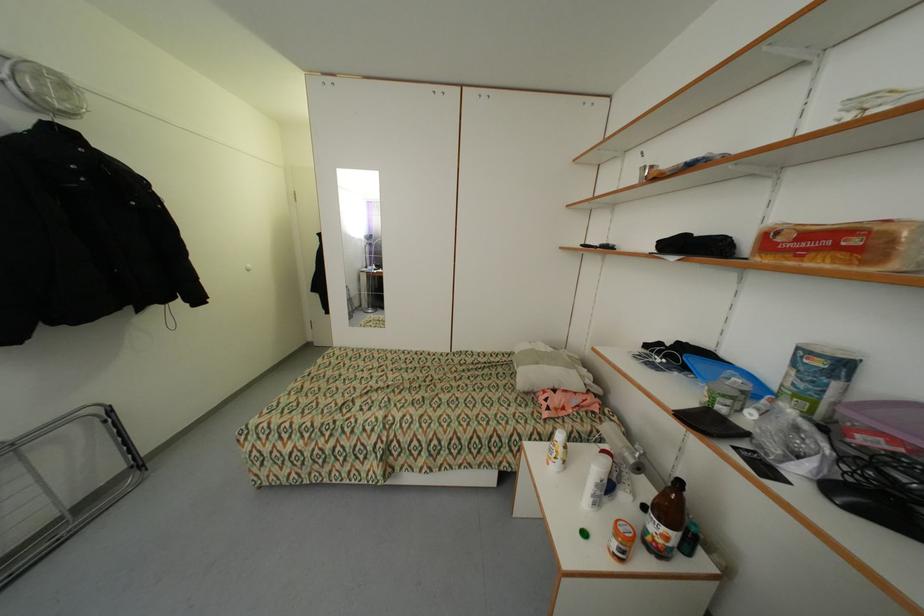
Identify the location of silver aerosol can. The height and width of the screenshot is (616, 924). (633, 459).